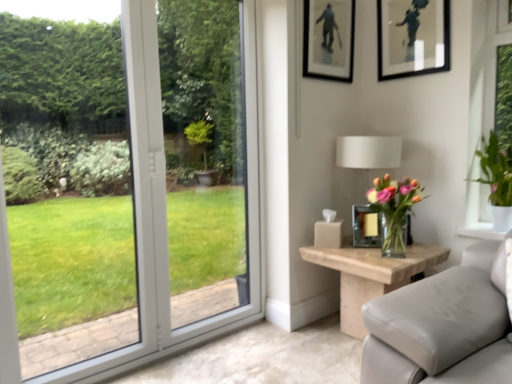
At what (x,y) coordinates should I click in order to perform the action: click on free area below translucent glass vase at right, the 2th houseplant positioned from the right (from a real-world perspective). Please return your answer as a coordinate pair (x, y). This screenshot has height=384, width=512. Looking at the image, I should click on (398, 254).